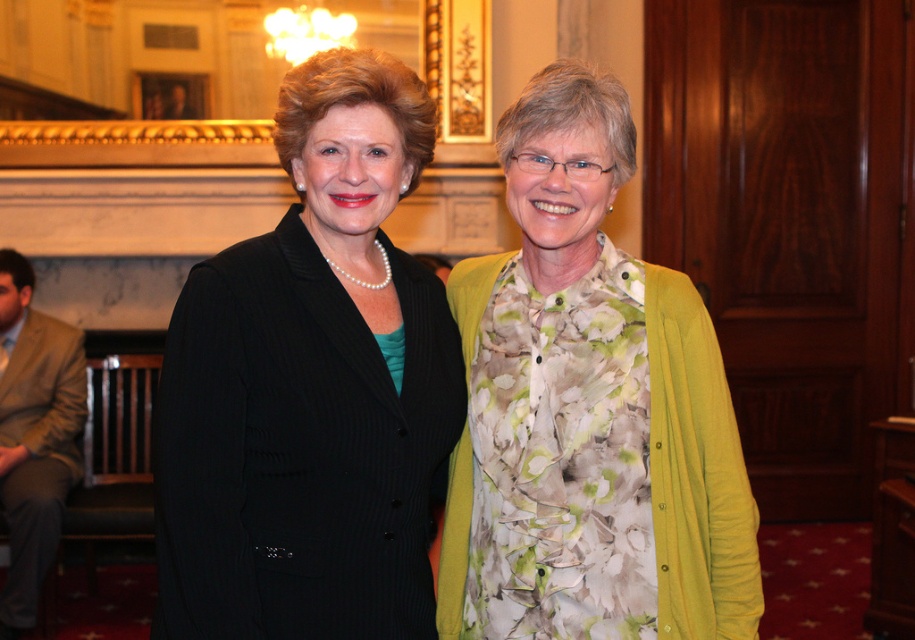
You are a photographer setting up for a group photo. You need to position the black textured blazer at center and the floral fabric dress at center so that both are visible in the frame. Given their sizes, which object should be placed closer to the camera to ensure both fit well in the photo?

The black textured blazer at center is larger in size than the floral fabric dress at center. To ensure both fit well in the photo, the floral fabric dress at center should be placed closer to the camera since it is smaller and requires less space, allowing the larger blazer to be slightly farther back but still visible.

You are attending a formal event and need to take a photo with both the floral fabric dress at center and the tan fabric suit at left. Since the photographer wants the dress to appear larger in the photo, which one should you stand closer to?

You should stand closer to the floral fabric dress at center because it is already closer to the viewer than the tan fabric suit at left, so positioning yourself nearer to it will make it appear even larger in the photo.